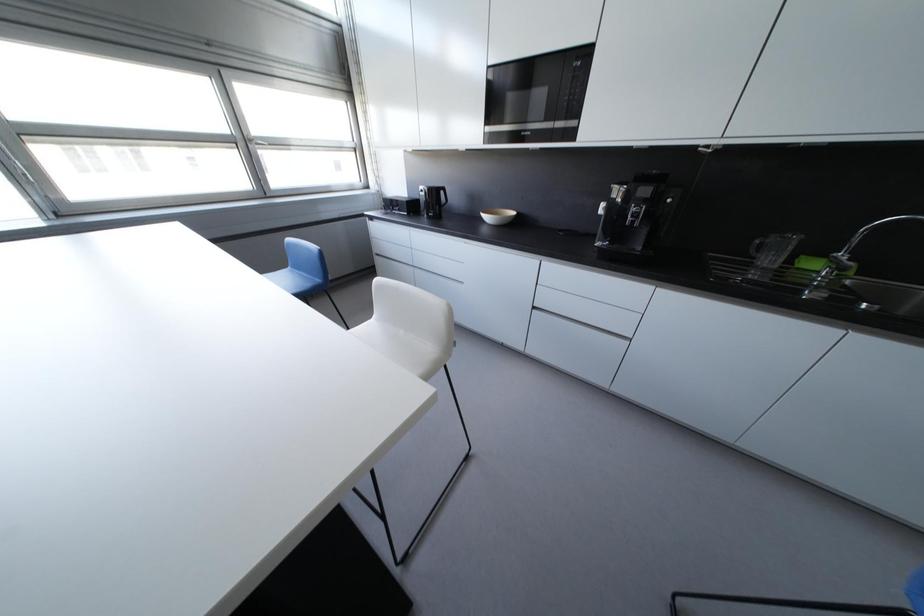
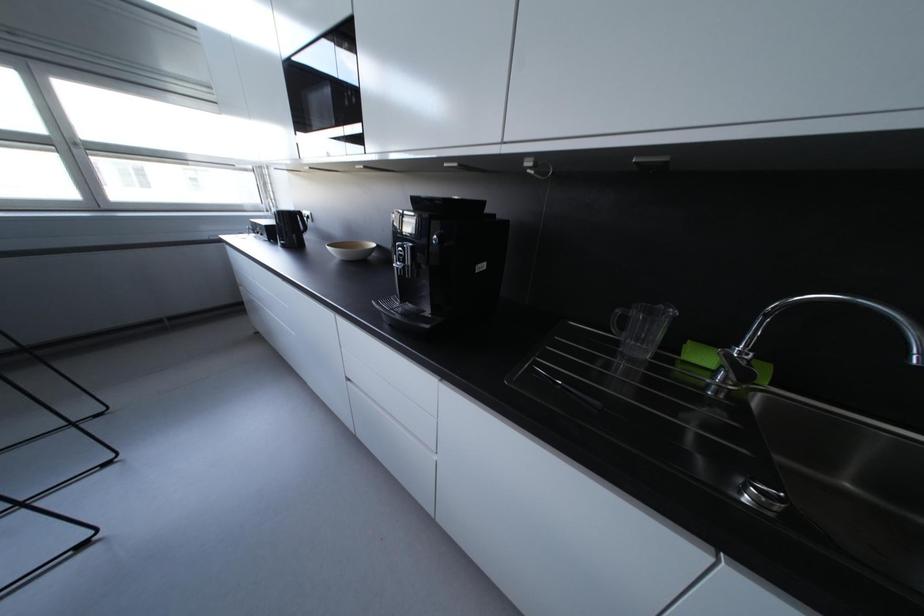
What movement of the cameraman would produce the second image?

The cameraman walked toward right, forward.